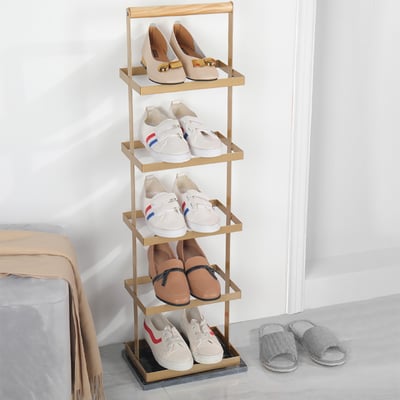
Where is `shelves`? This screenshot has height=400, width=400. shelves is located at coordinates pos(167,371), pos(170,306), pos(174,238), pos(179,163), pos(181,87).